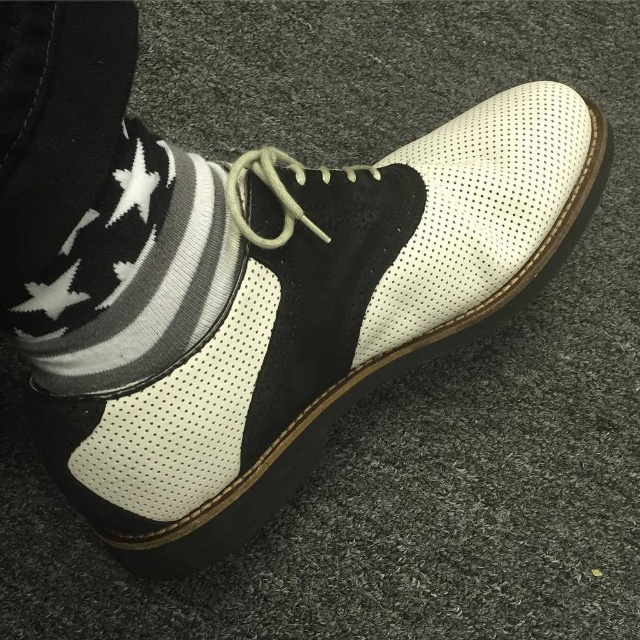
You are standing in a room and see the white perforated leather shoe at center and the white knitted sock at lower left. Which object is positioned more to the right side?

The white perforated leather shoe at center is positioned more to the right side than the white knitted sock at lower left.

You are standing in front of the white perforated leather shoe at center and the white knitted sock at lower left. Which object is closer to you?

The white perforated leather shoe at center is closer to you than the white knitted sock at lower left.